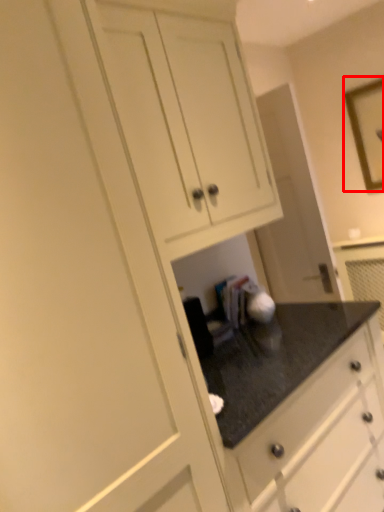
Question: From the image, what is the correct spatial relationship of picture frame (annotated by the red box) in relation to cabinetry?

Choices:
 (A) left
 (B) right

Answer: (B)